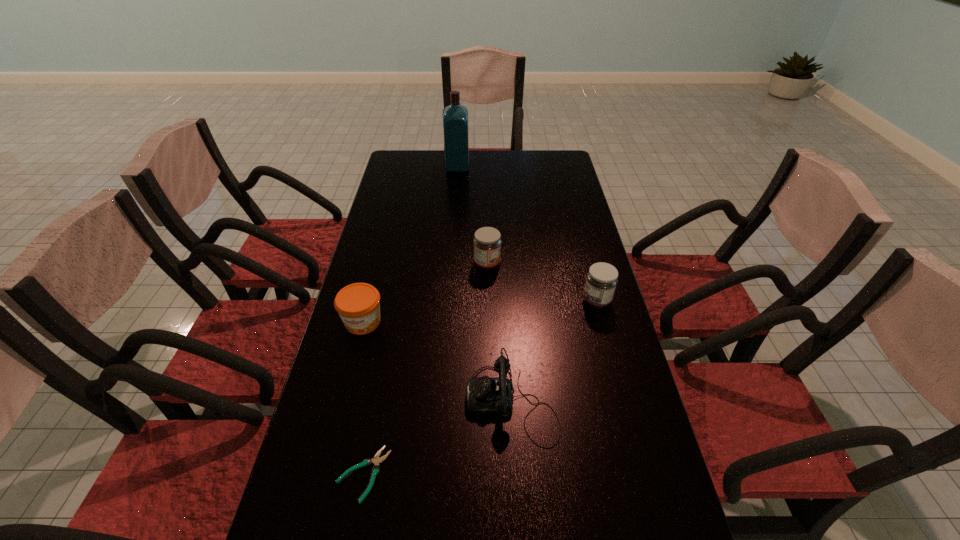
Locate an element on the screen. The image size is (960, 540). vacant space that satisfies the following two spatial constraints: 1. on the back side of the second jam from right to left; 2. on the flat label side of the third object from left to right is located at coordinates (486, 167).

The width and height of the screenshot is (960, 540). In order to click on vacant area in the image that satisfies the following two spatial constraints: 1. on the flat label side of the tallest object; 2. on the front label of the leftmost jam in this screenshot , I will do `click(446, 322)`.

You are a GUI agent. You are given a task and a screenshot of the screen. Output one action in this format:
    pyautogui.click(x=<x>, y=<y>)
    Task: Click on the free space that satisfies the following two spatial constraints: 1. on the front label of the shortest object; 2. on the right side of the shortest jam
    This screenshot has width=960, height=540.
    Given the screenshot: What is the action you would take?
    click(324, 474)